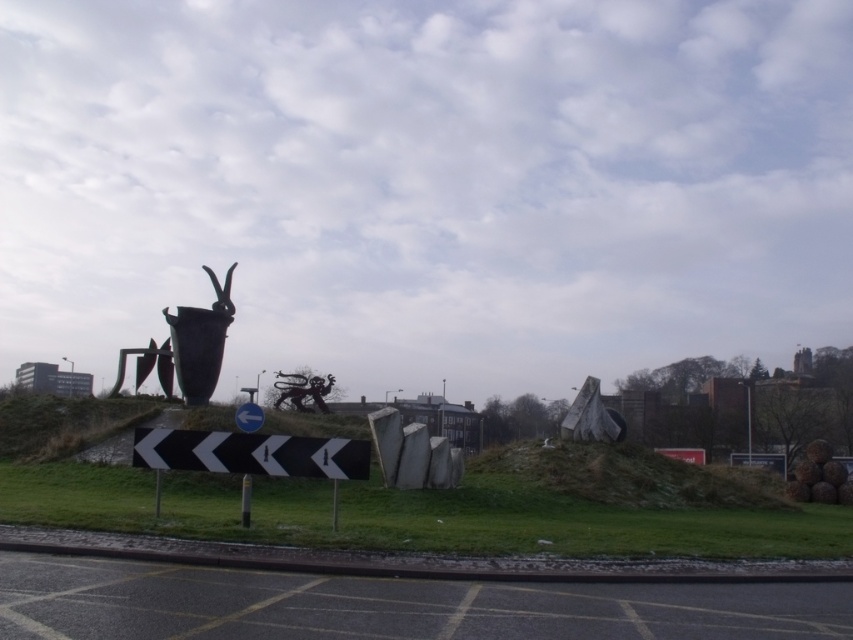
Question: Does polished bronze vase at center have a greater width compared to smooth concrete slabs at center?

Choices:
 (A) no
 (B) yes

Answer: (A)

Question: Which point is closer to the camera?

Choices:
 (A) (807, 509)
 (B) (405, 477)
 (C) (184, 320)

Answer: (B)

Question: Which object is farther from the camera taking this photo?

Choices:
 (A) polished bronze vase at center
 (B) green grass at lower center

Answer: (A)

Question: Can you confirm if polished bronze vase at center is positioned below smooth concrete slabs at center?

Choices:
 (A) yes
 (B) no

Answer: (B)

Question: Estimate the real-world distances between objects in this image. Which object is farther from the green grass at lower center?

Choices:
 (A) smooth concrete slabs at center
 (B) polished bronze vase at center

Answer: (B)

Question: Does polished bronze vase at center have a greater width compared to smooth concrete slabs at center?

Choices:
 (A) yes
 (B) no

Answer: (B)